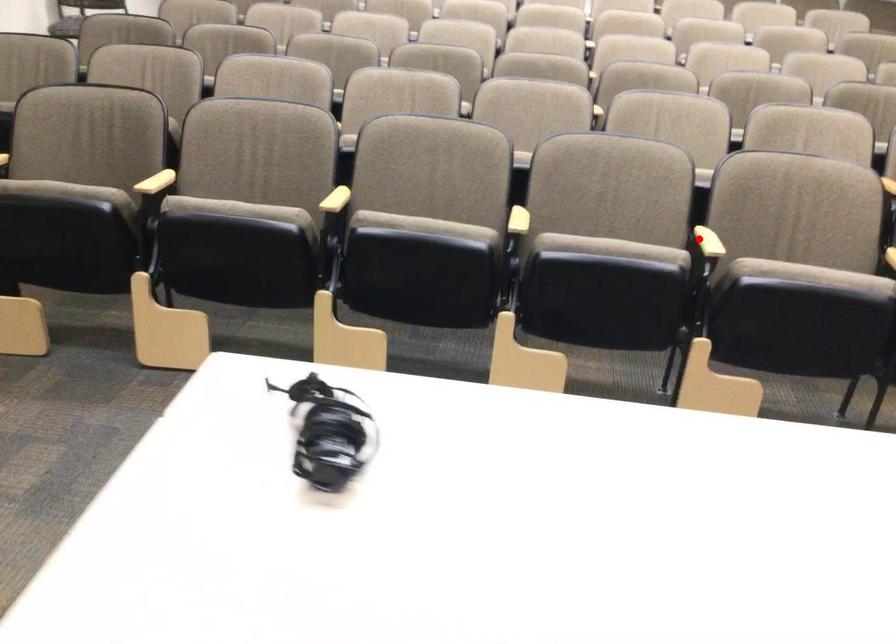
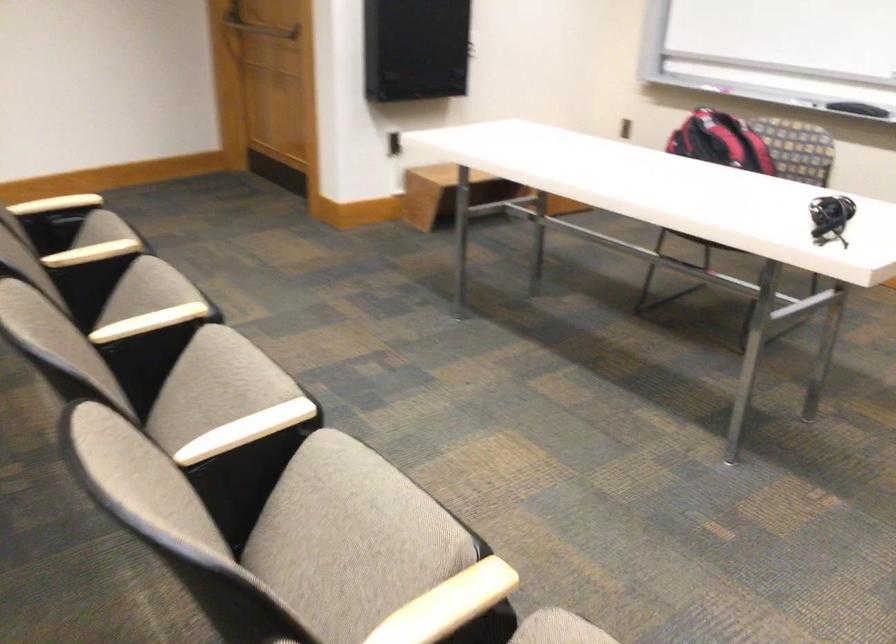
Find the pixel in the second image that matches the highlighted location in the first image.

(149, 322)